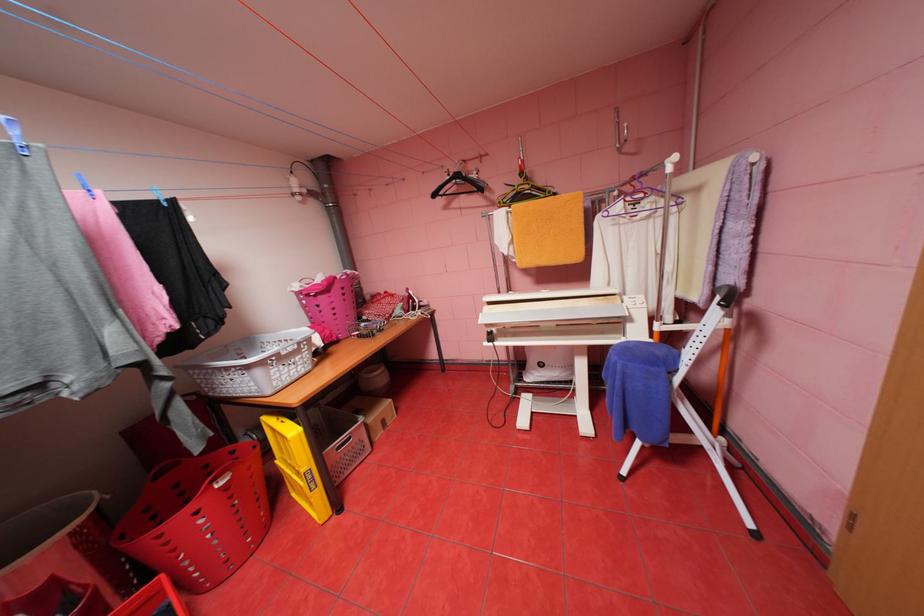
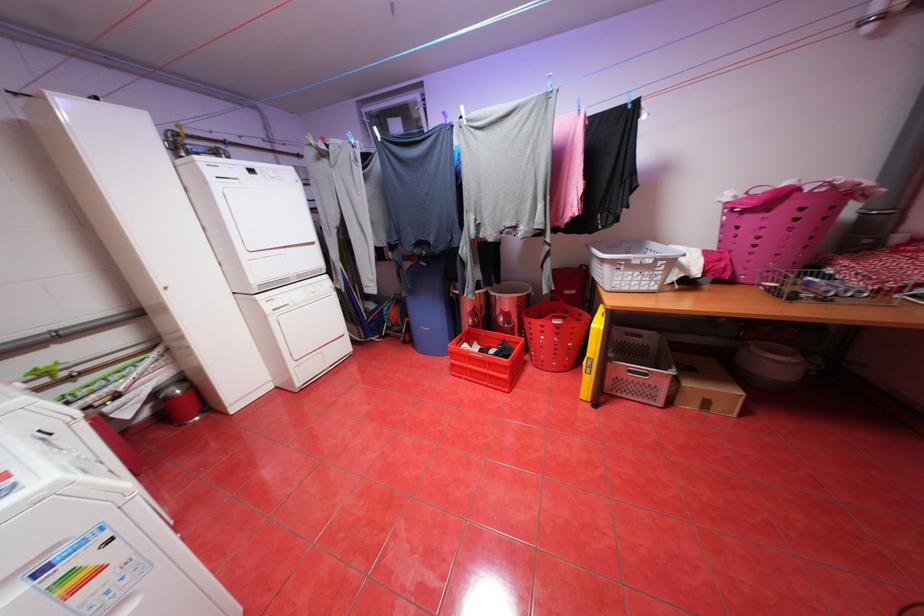
Where in the second image is the point corresponding to (x=370, y=419) from the first image?

(681, 371)